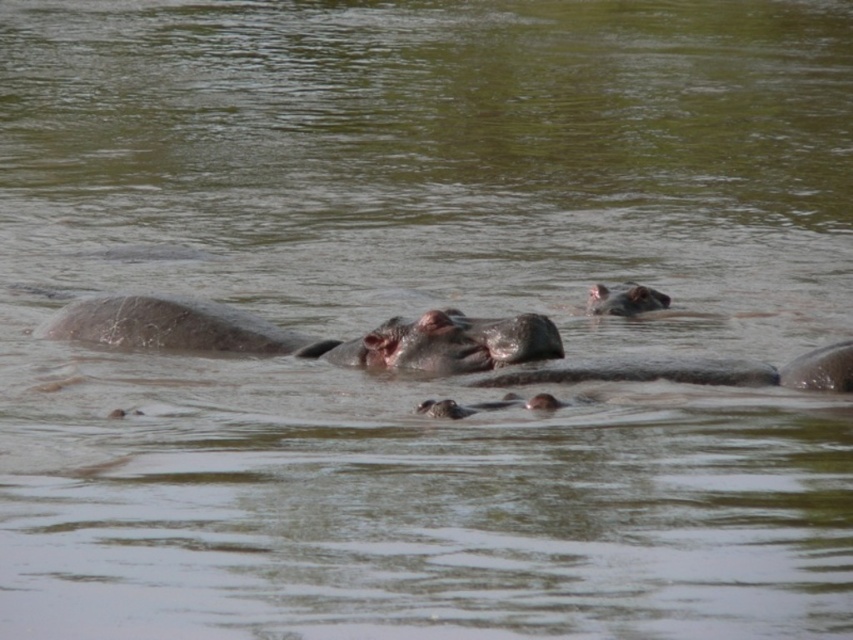
Between pink matte hippo at center and gray matte hippo at upper center, which one appears on the left side from the viewer's perspective?

pink matte hippo at center

What are the coordinates of `pink matte hippo at center` in the screenshot? It's located at (306, 337).

Find the location of `gray matte hippo at center`. gray matte hippo at center is located at coordinates (444, 342).

Does point (401, 323) lie in front of point (434, 310)?

That is False.

At what (x,y) coordinates should I click in order to perform the action: click on gray matte hippo at center. Please return your answer as a coordinate pair (x, y). Looking at the image, I should click on (444, 342).

Which is more to the right, gray matte hippo at upper center or smooth gray hippo mouth at center?

gray matte hippo at upper center is more to the right.

Based on the photo, does gray matte hippo at upper center have a smaller size compared to smooth gray hippo mouth at center?

Actually, gray matte hippo at upper center might be larger than smooth gray hippo mouth at center.

Which is in front, point (608, 294) or point (426, 317)?

Point (426, 317)

This screenshot has height=640, width=853. I want to click on gray matte hippo at upper center, so click(x=624, y=300).